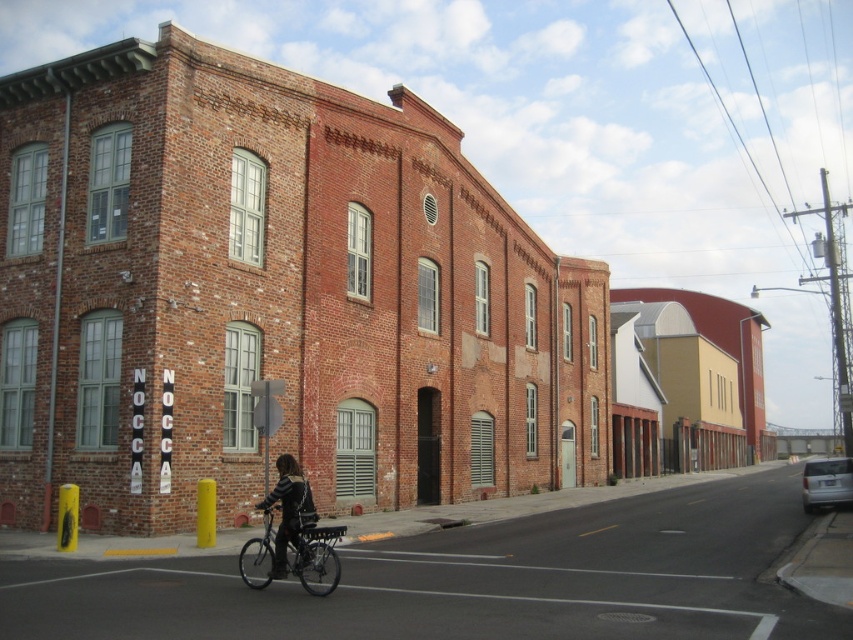
Based on the photo, you are standing on the sidewalk next to the two yellow bollards in front of the large red brick building. You see a silver metallic bicycle at center and a leather jacket at center. Can you reach both items without moving from your current position?

The silver metallic bicycle at center is 3.51 feet away from leather jacket at center. Since you are standing next to the yellow bollards, which are on the sidewalk, and both items are at the center of the image, it is likely that you can reach both items without moving from your current position if they are within your arm reach. However, the exact distance between them is 3.51 feet, so if your arm span allows, you can reach both.

You are a delivery person who needs to park your silver metallic bicycle at center and place your leather jacket at center on the sidewalk. Given the space between the two yellow bollards in front of the building, can you fit both items without overlapping?

The silver metallic bicycle at center is smaller than the leather jacket at center, so both items can fit between the yellow bollards if there is enough space. However, the exact arrangement depends on the available space between the bollards.

You are standing on the sidewalk in front of the large red brick building and notice two points marked on the ground. The first point is at coordinate point(312, 572) and the second is at point(280, 536). If you were to walk towards the building, which point would you encounter first?

Point(312, 572) is further to the viewer than point(280, 536), so you would encounter point(312, 572) first as you walk towards the building.